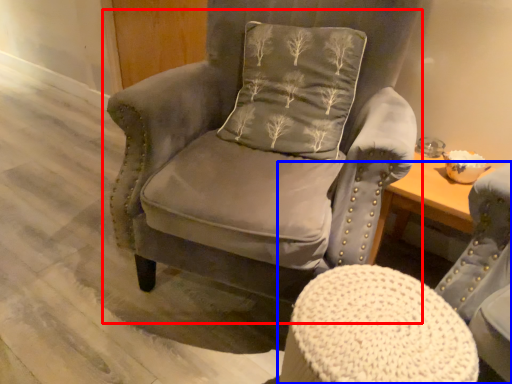
Question: Which of the following is the farthest to the observer, chair (highlighted by a red box) or chair (highlighted by a blue box)?

Choices:
 (A) chair
 (B) chair

Answer: (A)